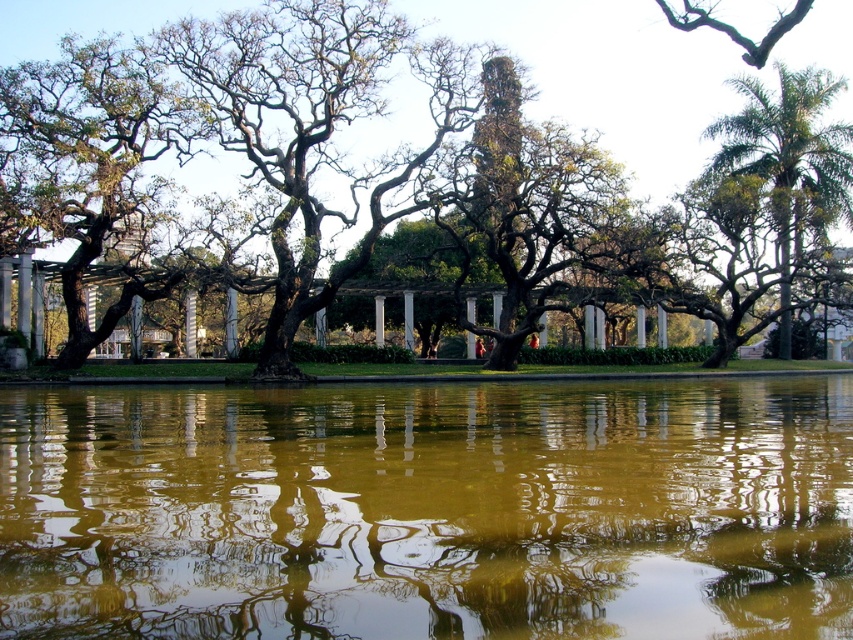
Question: Which point appears closest to the camera in this image?

Choices:
 (A) coord(374,122)
 (B) coord(32,104)

Answer: (B)

Question: Considering the real-world distances, which object is closest to the green reflective water at center?

Choices:
 (A) green leafy palm at right
 (B) green leafy tree at center

Answer: (A)

Question: Is green leafy tree at center further to the viewer compared to green leafy palm at right?

Choices:
 (A) yes
 (B) no

Answer: (B)

Question: Among these objects, which one is farthest from the camera?

Choices:
 (A) green leafy palm at right
 (B) green reflective water at center
 (C) green leafy tree at center
 (D) green leafy tree at left

Answer: (A)

Question: From the image, what is the correct spatial relationship of green leafy tree at left in relation to green leafy palm at right?

Choices:
 (A) above
 (B) below

Answer: (A)

Question: Is green leafy tree at center below green leafy palm at right?

Choices:
 (A) no
 (B) yes

Answer: (A)